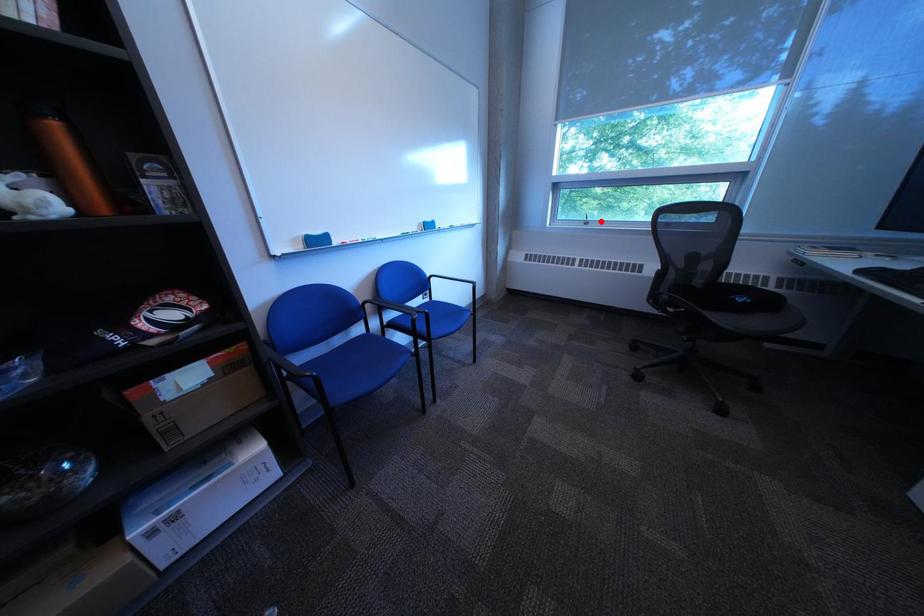
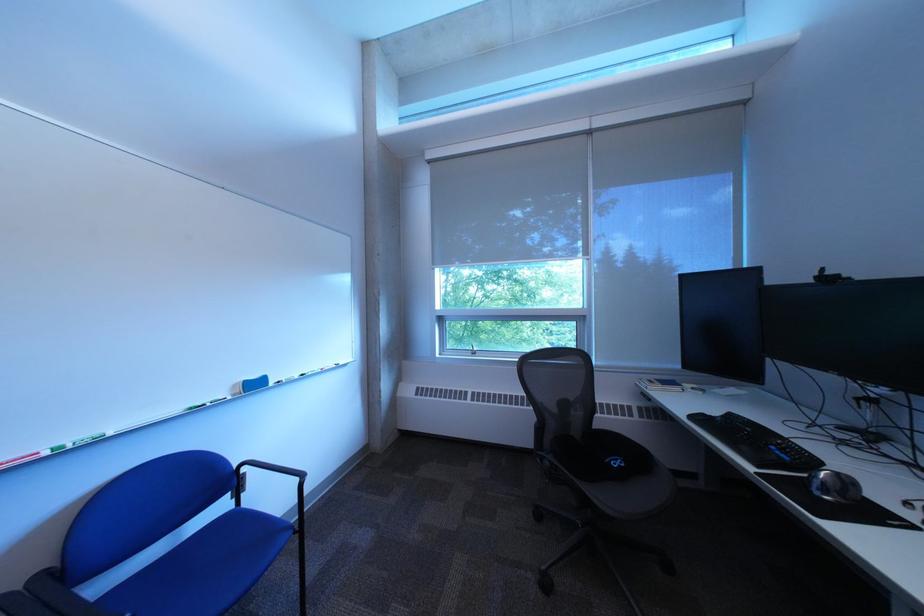
Locate, in the second image, the point that corresponds to the highlighted location in the first image.

(488, 351)